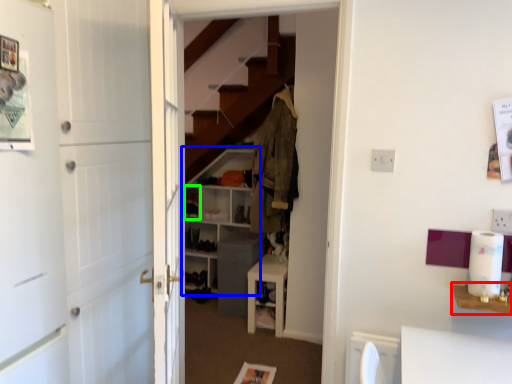
Question: Estimate the real-world distances between objects in this image. Which object is closer to table (highlighted by a red box), shelf (highlighted by a blue box) or shelf (highlighted by a green box)?

Choices:
 (A) shelf
 (B) shelf

Answer: (A)